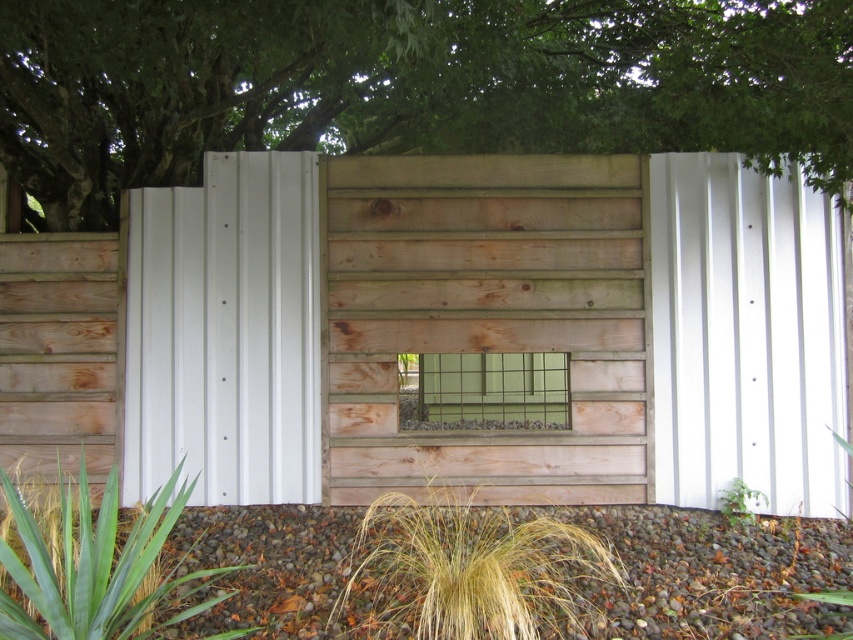
Consider the image. Is green leafy tree at upper center to the left of green leafy plant at lower right from the viewer's perspective?

Indeed, green leafy tree at upper center is positioned on the left side of green leafy plant at lower right.

Can you confirm if green leafy tree at upper center is wider than green leafy plant at lower right?

Yes, green leafy tree at upper center is wider than green leafy plant at lower right.

The height and width of the screenshot is (640, 853). What do you see at coordinates (409, 84) in the screenshot?
I see `green leafy tree at upper center` at bounding box center [409, 84].

You are a GUI agent. You are given a task and a screenshot of the screen. Output one action in this format:
    pyautogui.click(x=<x>, y=<y>)
    Task: Click on the green leafy tree at upper center
    The height and width of the screenshot is (640, 853).
    Given the screenshot: What is the action you would take?
    pyautogui.click(x=409, y=84)

Can you confirm if golden grass at center is positioned to the right of green leafy plant at lower right?

Incorrect, golden grass at center is not on the right side of green leafy plant at lower right.

Is point (505, 536) farther from camera compared to point (722, 512)?

No, (505, 536) is closer to viewer.

Where is `golden grass at center`? golden grass at center is located at coordinates (466, 572).

Find the location of a particular element. The image size is (853, 640). golden grass at center is located at coordinates (466, 572).

From the picture: Is green leafy tree at upper center thinner than golden grass at center?

Correct, green leafy tree at upper center's width is less than golden grass at center's.

Consider the image. Which is more to the left, green leafy tree at upper center or golden grass at center?

green leafy tree at upper center

Describe the element at coordinates (409, 84) in the screenshot. I see `green leafy tree at upper center` at that location.

Find the location of a particular element. green leafy tree at upper center is located at coordinates (409, 84).